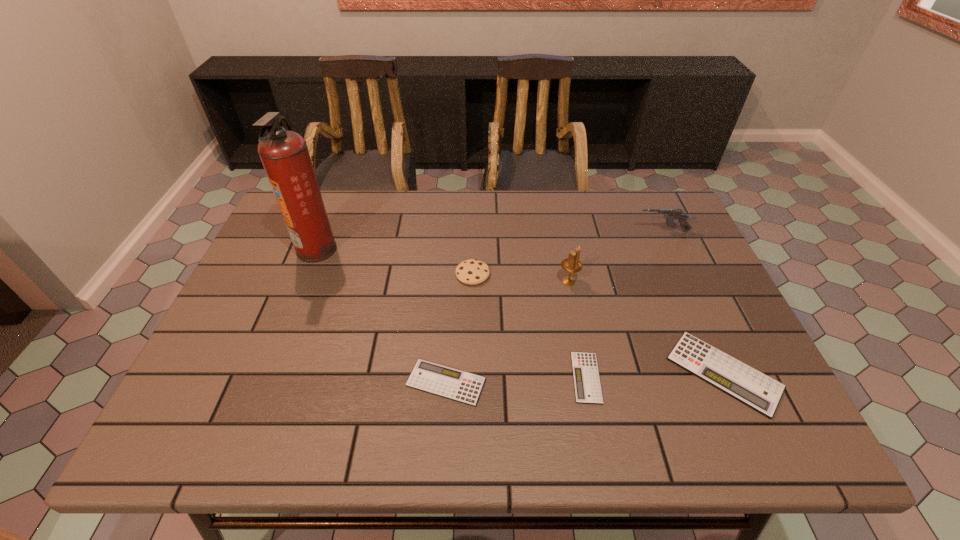
Where is `gun situated at the far edge`? The image size is (960, 540). gun situated at the far edge is located at coordinates (671, 214).

Where is `fire extinguisher located in the far edge section of the desktop`? fire extinguisher located in the far edge section of the desktop is located at coordinates (284, 154).

This screenshot has height=540, width=960. Find the location of `object that is at the left edge`. object that is at the left edge is located at coordinates pyautogui.click(x=284, y=154).

Find the location of a particular element. This screenshot has width=960, height=540. calculator situated at the right edge is located at coordinates (749, 386).

At what (x,y) coordinates should I click in order to perform the action: click on gun positioned at the right edge. Please return your answer as a coordinate pair (x, y). Image resolution: width=960 pixels, height=540 pixels. Looking at the image, I should click on (671, 214).

Find the location of a particular element. The height and width of the screenshot is (540, 960). object that is at the far left corner is located at coordinates click(x=284, y=154).

Locate an element on the screen. The height and width of the screenshot is (540, 960). object that is at the far right corner is located at coordinates [x=671, y=214].

I want to click on object that is at the near right corner, so click(749, 386).

Where is `blank area at the far edge`? This screenshot has width=960, height=540. blank area at the far edge is located at coordinates (427, 230).

In the image, there is a desktop. What are the coordinates of `free space at the near edge` in the screenshot? It's located at (559, 402).